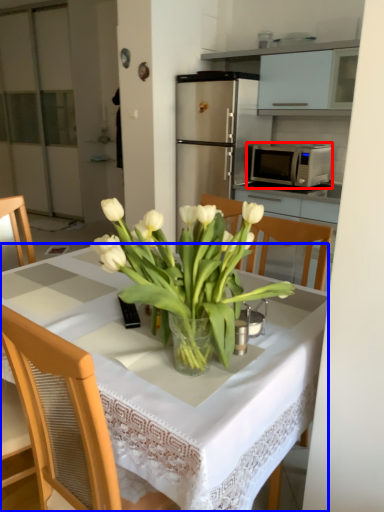
Question: Among these objects, which one is nearest to the camera, microwave oven (highlighted by a red box) or desk (highlighted by a blue box)?

Choices:
 (A) microwave oven
 (B) desk

Answer: (B)